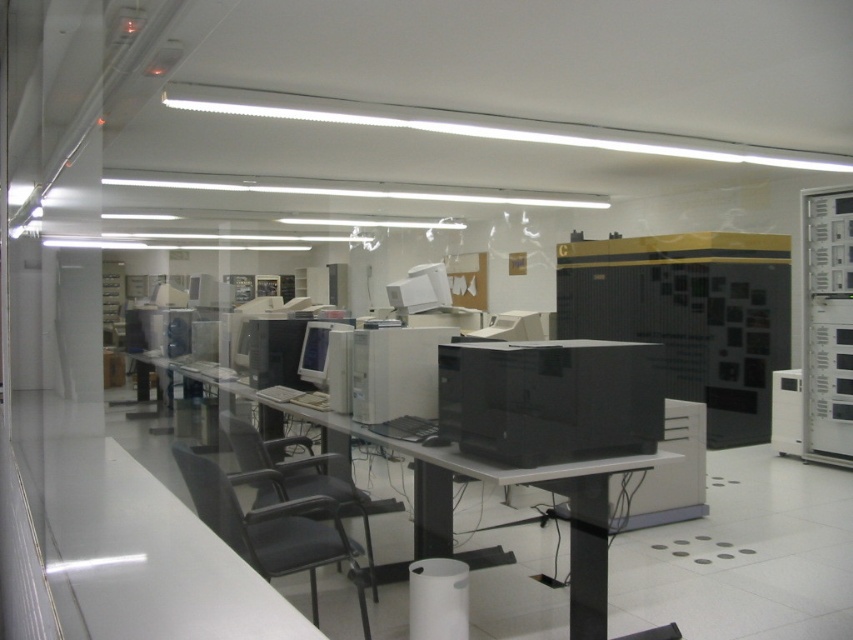
Question: Which point is closer to the camera?

Choices:
 (A) (312, 490)
 (B) (308, 364)

Answer: (A)

Question: Among these points, which one is nearest to the camera?

Choices:
 (A) (318, 332)
 (B) (637, 634)
 (C) (585, 452)
 (D) (426, 298)

Answer: (C)

Question: Considering the real-world distances, which object is closest to the black plastic table at center?

Choices:
 (A) matte white monitor at center
 (B) black fabric swivel chair at center
 (C) black matte desktop computer at center

Answer: (C)

Question: Can you confirm if black plastic table at center is wider than matte white monitor at center?

Choices:
 (A) yes
 (B) no

Answer: (A)

Question: Does black fabric swivel chair at center appear on the right side of matte gray monitor at center?

Choices:
 (A) yes
 (B) no

Answer: (A)

Question: Is black fabric swivel chair at center bigger than matte gray monitor at center?

Choices:
 (A) no
 (B) yes

Answer: (B)